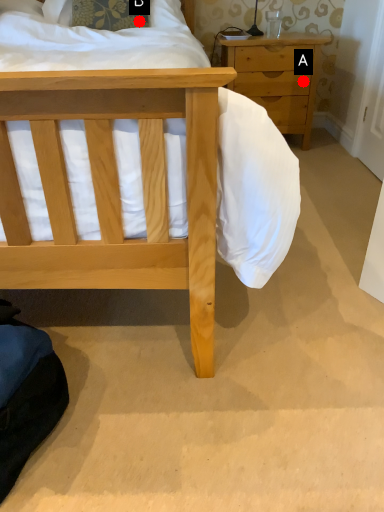
Question: Two points are circled on the image, labeled by A and B beside each circle. Which of the following is the farthest from the observer?

Choices:
 (A) A is further
 (B) B is further

Answer: (A)